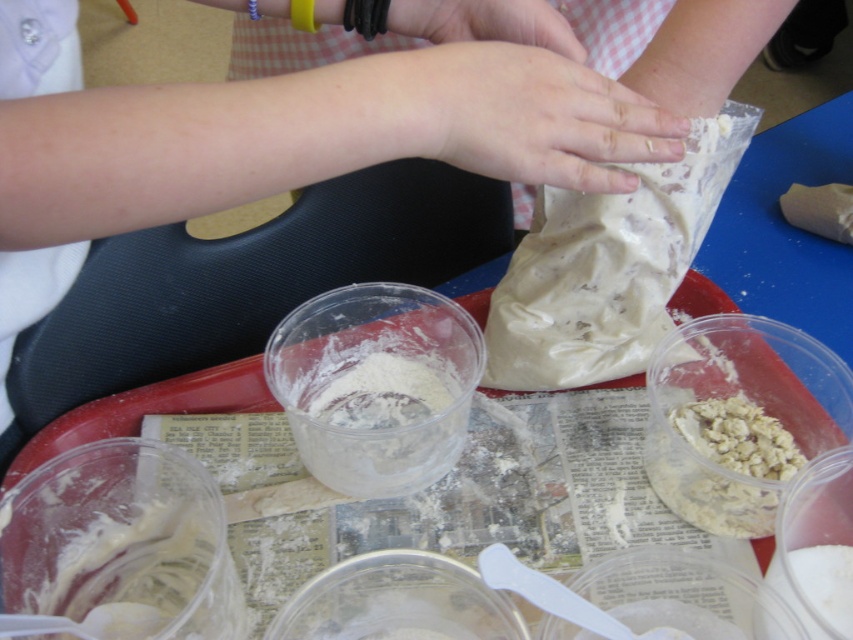
You are a baker trying to measure the white crumbly at center and the smooth skin hand at upper center. Which one is bigger in size?

The white crumbly at center is larger in size than the smooth skin hand at upper center.

You are a baker trying to fit the smooth beige dough at upper center and the white matte plastic bag at center into a storage container. Which item requires a wider container based on their sizes?

The smooth beige dough at upper center requires a wider container because its width is larger than the white matte plastic bag at center.